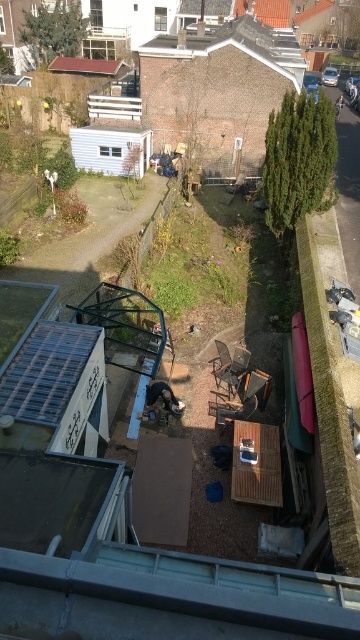
Question: Among these points, which one is farthest from the camera?

Choices:
 (A) 303,67
 (B) 222,408

Answer: (A)

Question: Which point is closer to the camera taking this photo?

Choices:
 (A) (248, 38)
 (B) (253, 397)
 (C) (117, 67)

Answer: (B)

Question: Is brown shingles at upper center thinner than wooden chair at center?

Choices:
 (A) yes
 (B) no

Answer: (B)

Question: Is brown shingles at upper center bigger than wooden chair at center?

Choices:
 (A) no
 (B) yes

Answer: (B)

Question: Does brown shingles at upper center have a lesser width compared to wooden chair at center?

Choices:
 (A) yes
 (B) no

Answer: (B)

Question: Which of the following is the farthest from the observer?

Choices:
 (A) brown shingles at upper center
 (B) red tile roof at upper center
 (C) wooden chair at center

Answer: (B)